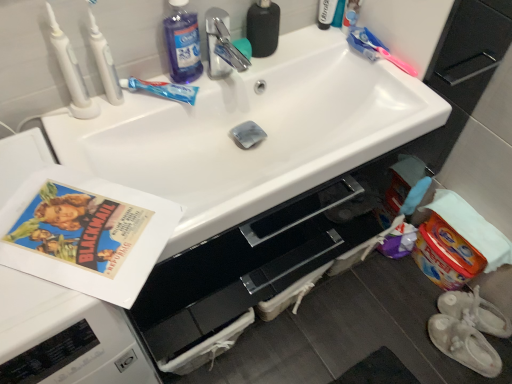
Where is `free spot to the right of white plastic toothbrush at upper left, arranged as the fourth toothbrush when viewed from the right`? This screenshot has width=512, height=384. free spot to the right of white plastic toothbrush at upper left, arranged as the fourth toothbrush when viewed from the right is located at coordinates (142, 104).